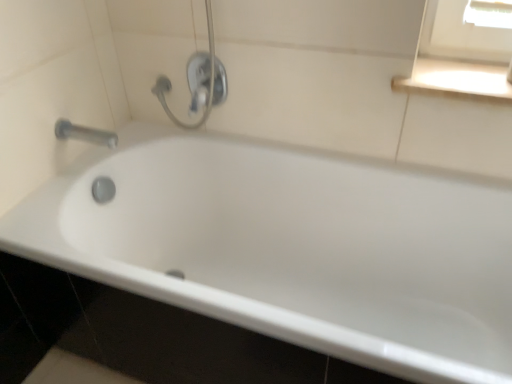
Question: Considering the relative positions of white glossy bathtub at center and satin nickel faucet at upper center in the image provided, is white glossy bathtub at center to the left or to the right of satin nickel faucet at upper center?

Choices:
 (A) left
 (B) right

Answer: (B)

Question: From the image's perspective, is white glossy bathtub at center positioned above or below satin nickel faucet at upper center?

Choices:
 (A) below
 (B) above

Answer: (A)

Question: Which of these objects is positioned closest to the white glossy bathtub at center?

Choices:
 (A) silver metallic tap at upper left
 (B) satin nickel faucet at upper center
 (C) white glossy window sill at upper right

Answer: (B)

Question: Which of these objects is positioned farthest from the satin nickel faucet at upper center?

Choices:
 (A) silver metallic tap at upper left
 (B) white glossy bathtub at center
 (C) white glossy window sill at upper right

Answer: (C)